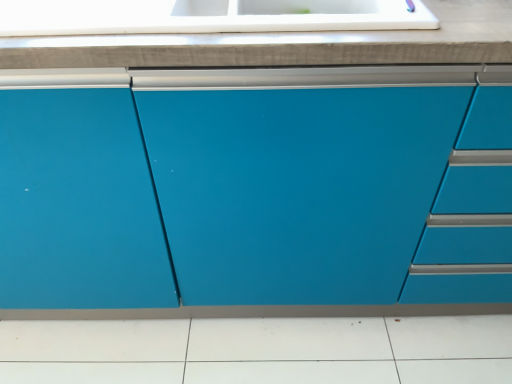
Question: Is matte blue cabinet at center wider or thinner than white glossy countertop at upper center?

Choices:
 (A) thin
 (B) wide

Answer: (B)

Question: In terms of size, does matte blue cabinet at center appear bigger or smaller than white glossy countertop at upper center?

Choices:
 (A) big
 (B) small

Answer: (A)

Question: From a real-world perspective, is matte blue cabinet at center physically located above or below white glossy countertop at upper center?

Choices:
 (A) below
 (B) above

Answer: (A)

Question: Relative to matte blue cabinet at center, is white glossy countertop at upper center in front or behind?

Choices:
 (A) front
 (B) behind

Answer: (B)

Question: From the image's perspective, is white glossy countertop at upper center above or below matte blue cabinet at center?

Choices:
 (A) above
 (B) below

Answer: (A)

Question: Is point (311, 59) positioned closer to the camera than point (422, 99)?

Choices:
 (A) farther
 (B) closer

Answer: (B)

Question: Is white glossy countertop at upper center inside the boundaries of matte blue cabinet at center, or outside?

Choices:
 (A) inside
 (B) outside

Answer: (A)